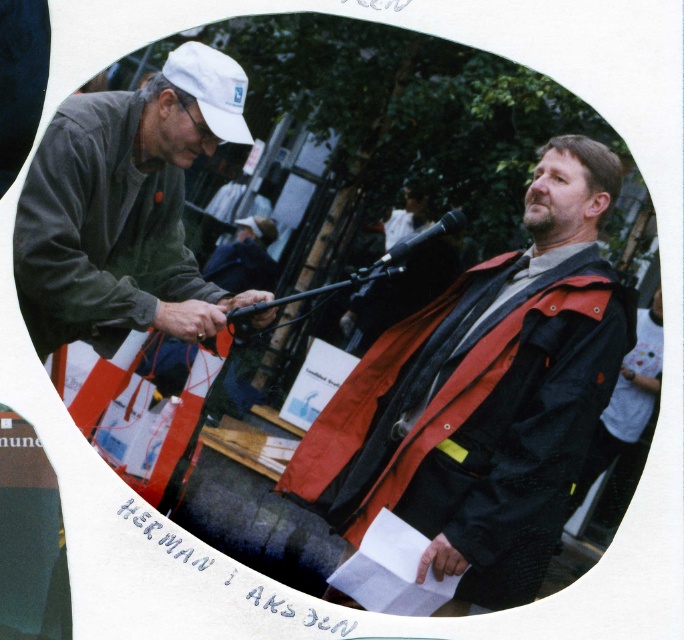
You are a photographer who wants to ensure that both the matte gray sweater at left and the white matte cap at upper left are clearly visible in your composition. Based on their positions, which object should you focus on first to ensure both are in frame?

The matte gray sweater at left is positioned on the left side of white matte cap at upper left, so you should focus on the white matte cap at upper left first to ensure both objects remain in frame.

You are a photographer trying to adjust the lighting for a portrait. You notice the matte gray sweater at left and the white matte cap at upper left in your frame. Which object should you focus the light on if you want to highlight the taller one?

The matte gray sweater at left is taller than the white matte cap at upper left, so you should focus the light on the matte gray sweater at left to highlight the taller object.